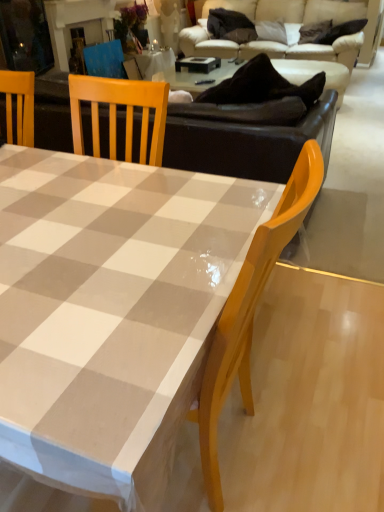
Question: From a real-world perspective, does beige fabric couch at upper center sit lower than white glossy table at center?

Choices:
 (A) yes
 (B) no

Answer: (B)

Question: Is beige fabric couch at upper center to the left of white glossy table at center from the viewer's perspective?

Choices:
 (A) no
 (B) yes

Answer: (A)

Question: Can you confirm if beige fabric couch at upper center is smaller than white glossy table at center?

Choices:
 (A) no
 (B) yes

Answer: (A)

Question: Does beige fabric couch at upper center have a greater height compared to white glossy table at center?

Choices:
 (A) yes
 (B) no

Answer: (A)

Question: From the image's perspective, is beige fabric couch at upper center below white glossy table at center?

Choices:
 (A) no
 (B) yes

Answer: (A)

Question: From a real-world perspective, is beige fabric couch at upper center over white glossy table at center?

Choices:
 (A) yes
 (B) no

Answer: (A)

Question: Is white glossy table at center to the right of beige fabric couch at upper center from the viewer's perspective?

Choices:
 (A) yes
 (B) no

Answer: (B)

Question: Is beige fabric couch at upper center located within white glossy table at center?

Choices:
 (A) no
 (B) yes

Answer: (A)

Question: Is there a large distance between white glossy table at center and beige fabric couch at upper center?

Choices:
 (A) no
 (B) yes

Answer: (B)

Question: Is white glossy table at center shorter than beige fabric couch at upper center?

Choices:
 (A) yes
 (B) no

Answer: (A)

Question: Does white glossy table at center have a larger size compared to beige fabric couch at upper center?

Choices:
 (A) yes
 (B) no

Answer: (B)

Question: From a real-world perspective, is white glossy table at center below beige fabric couch at upper center?

Choices:
 (A) no
 (B) yes

Answer: (B)

Question: Considering the relative positions of beige fabric couch at upper center and white glossy table at center in the image provided, is beige fabric couch at upper center to the left or to the right of white glossy table at center?

Choices:
 (A) right
 (B) left

Answer: (A)